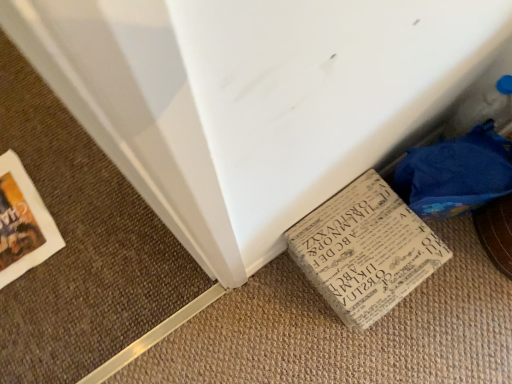
I want to click on vacant space in front of printed paper book at lower right, so click(x=381, y=348).